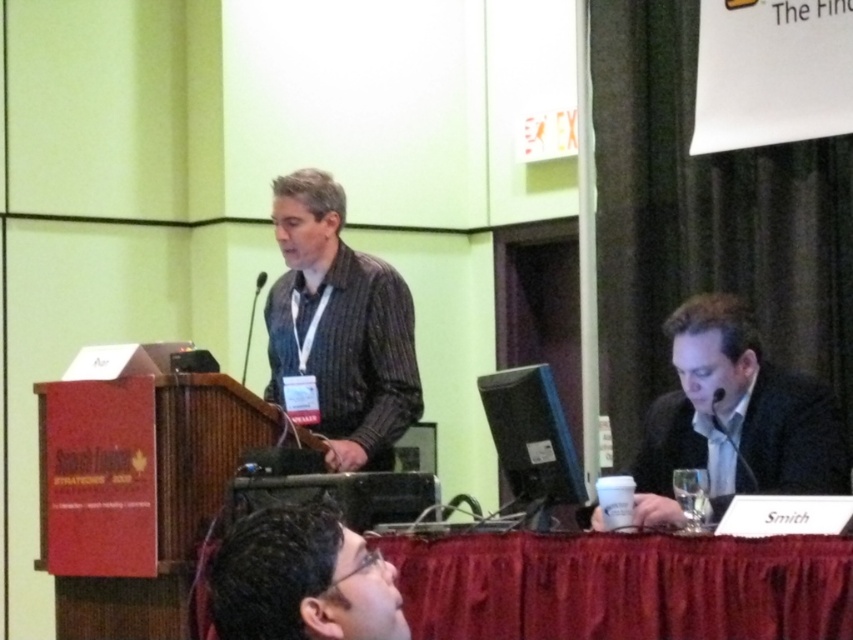
Can you confirm if black suit at right is positioned to the right of matte black glasses at lower center?

Correct, you'll find black suit at right to the right of matte black glasses at lower center.

Does black suit at right appear on the left side of matte black glasses at lower center?

In fact, black suit at right is to the right of matte black glasses at lower center.

Between point (819, 460) and point (341, 596), which one is positioned behind?

Point (819, 460)

I want to click on black suit at right, so (733, 417).

In the scene shown: Who is more forward, [605,547] or [341,397]?

Point [605,547] is more forward.

Can you confirm if smooth fabric tablecloth at lower center is smaller than striped fabric shirt at left?

Indeed, smooth fabric tablecloth at lower center has a smaller size compared to striped fabric shirt at left.

Is point (755, 608) farther from camera compared to point (294, 253)?

No, it is not.

You are a GUI agent. You are given a task and a screenshot of the screen. Output one action in this format:
    pyautogui.click(x=<x>, y=<y>)
    Task: Click on the smooth fabric tablecloth at lower center
    Image resolution: width=853 pixels, height=640 pixels.
    Given the screenshot: What is the action you would take?
    pyautogui.click(x=622, y=586)

Does point (374, 294) come in front of point (379, 576)?

No, it is behind (379, 576).

Where is `striped fabric shirt at left`? The width and height of the screenshot is (853, 640). striped fabric shirt at left is located at coordinates (338, 328).